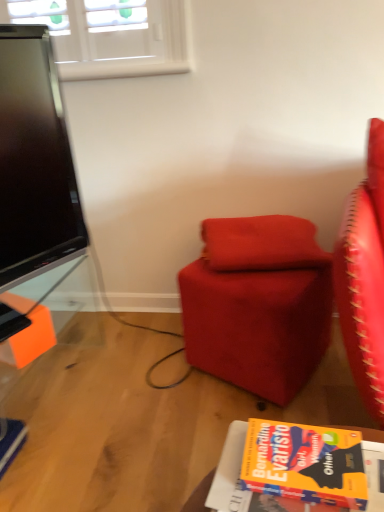
Question: Choose the correct answer: Is velvet red pillow at center inside suede-like red ottoman at center or outside it?

Choices:
 (A) inside
 (B) outside

Answer: (B)

Question: Is velvet red pillow at center in front of or behind suede-like red ottoman at center in the image?

Choices:
 (A) behind
 (B) front

Answer: (A)

Question: Which of these objects is positioned closest to the orange matte book at lower right?

Choices:
 (A) velvet red pillow at center
 (B) suede-like red ottoman at center

Answer: (B)

Question: Which is farther from the suede-like red ottoman at center?

Choices:
 (A) velvet red pillow at center
 (B) orange matte book at lower right

Answer: (B)